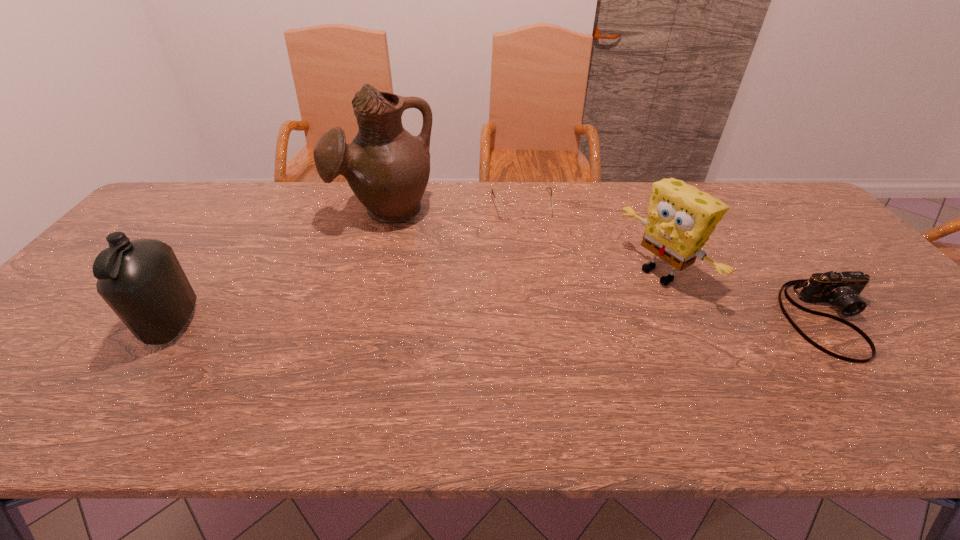
The image size is (960, 540). I want to click on free space on the desktop that is between the bottle and the fourth tallest object and is positioned through the lenses of the spectacles, so click(x=548, y=321).

Locate an element on the screen. This screenshot has height=540, width=960. free spot on the desktop that is between the leftmost object and the camera and is positioned at the spout of the pitcher is located at coordinates pos(409,322).

At what (x,y) coordinates should I click in order to perform the action: click on free spot on the desktop that is between the leftmost object and the camera and is positioned on the face of the sponge. Please return your answer as a coordinate pair (x, y). The height and width of the screenshot is (540, 960). Looking at the image, I should click on (576, 321).